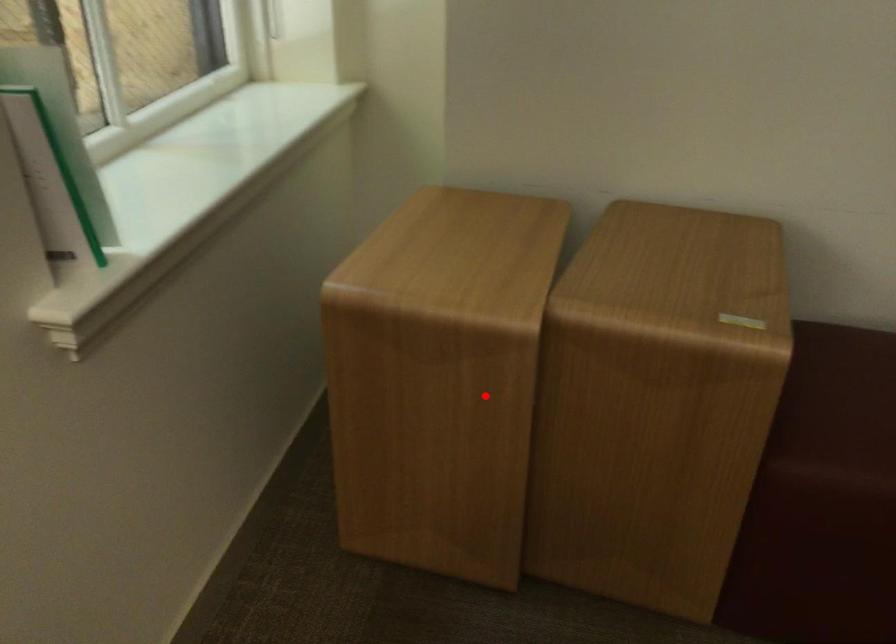
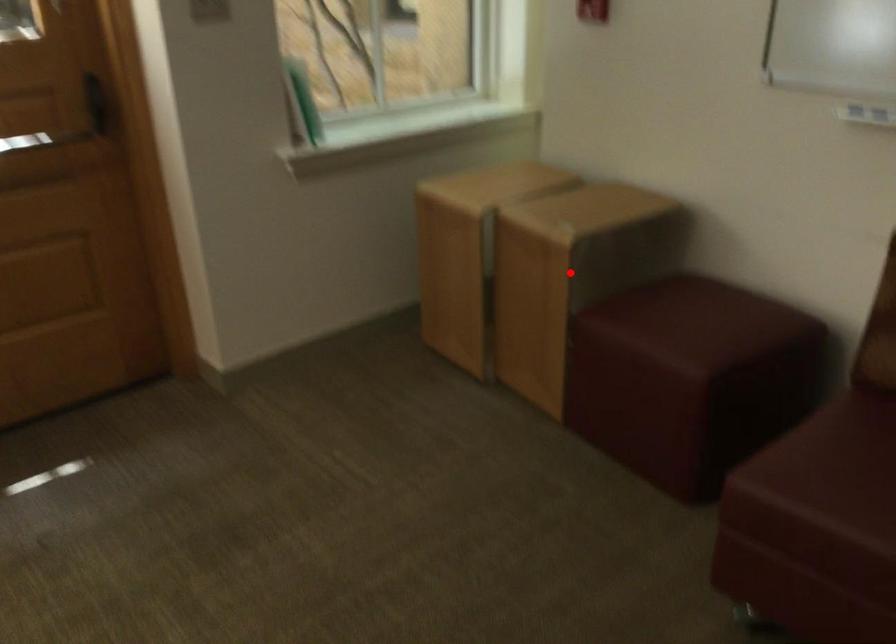
I am providing you with two images of the same scene from different viewpoints. A red point is marked on the first image and another point is marked on the second image. Are the points marked in image1 and image2 representing the same 3D position?

No